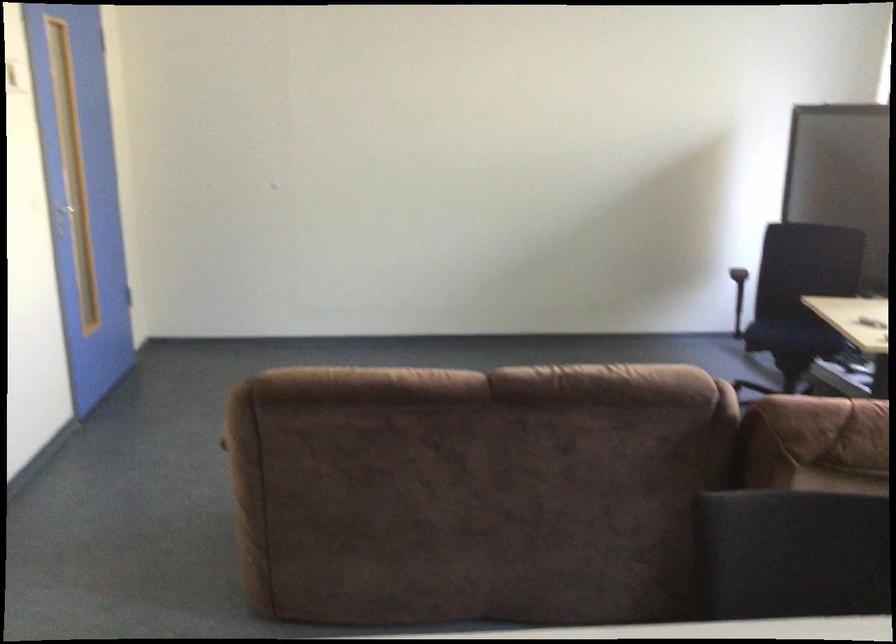
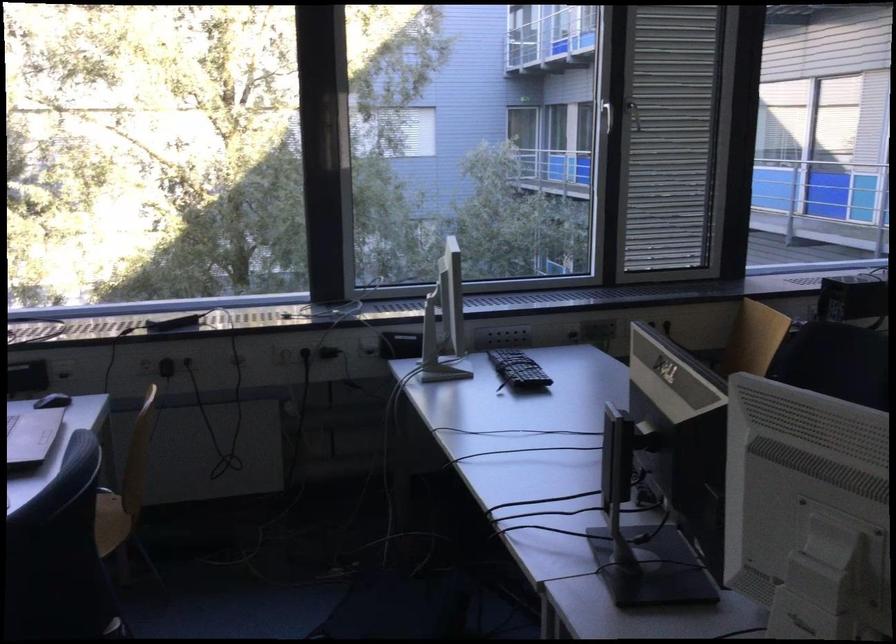
The images are taken continuously from a first-person perspective. In which direction is your viewpoint rotating?

The camera rotated toward right-down.